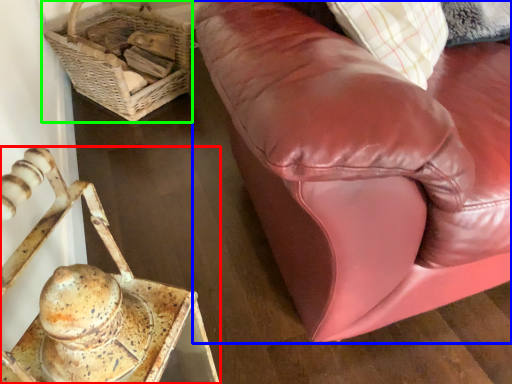
Question: Estimate the real-world distances between objects in this image. Which object is closer to furniture (highlighted by a red box), studio couch (highlighted by a blue box) or basket (highlighted by a green box)?

Choices:
 (A) studio couch
 (B) basket

Answer: (A)